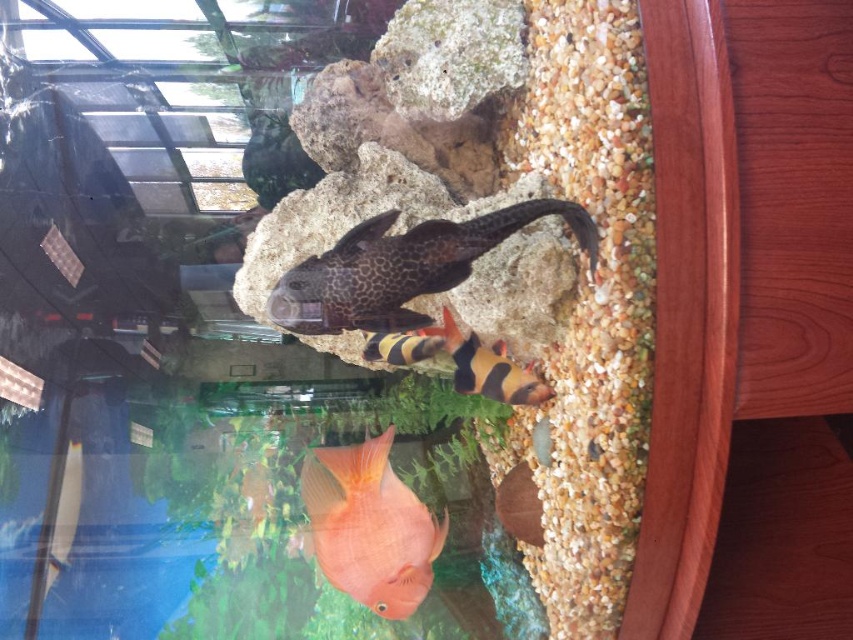
Can you confirm if leopard print rock at center is taller than orange matte goldfish at center?

No, leopard print rock at center is not taller than orange matte goldfish at center.

Is the position of leopard print rock at center more distant than that of orange matte goldfish at center?

Yes, leopard print rock at center is behind orange matte goldfish at center.

Is point (379, 221) positioned in front of point (424, 508)?

No, it is behind (424, 508).

The image size is (853, 640). What are the coordinates of `leopard print rock at center` in the screenshot? It's located at (402, 268).

Does orange matte goldfish at center appear on the left side of black and orange striped fish at center?

Correct, you'll find orange matte goldfish at center to the left of black and orange striped fish at center.

Describe the element at coordinates (370, 525) in the screenshot. This screenshot has width=853, height=640. I see `orange matte goldfish at center` at that location.

This screenshot has width=853, height=640. I want to click on orange matte goldfish at center, so click(370, 525).

Which is below, leopard print rock at center or black and orange striped fish at center?

black and orange striped fish at center

Consider the image. Who is shorter, leopard print rock at center or black and orange striped fish at center?

Standing shorter between the two is black and orange striped fish at center.

Identify the location of leopard print rock at center. This screenshot has width=853, height=640. (402, 268).

At what (x,y) coordinates should I click in order to perform the action: click on leopard print rock at center. Please return your answer as a coordinate pair (x, y). Looking at the image, I should click on (402, 268).